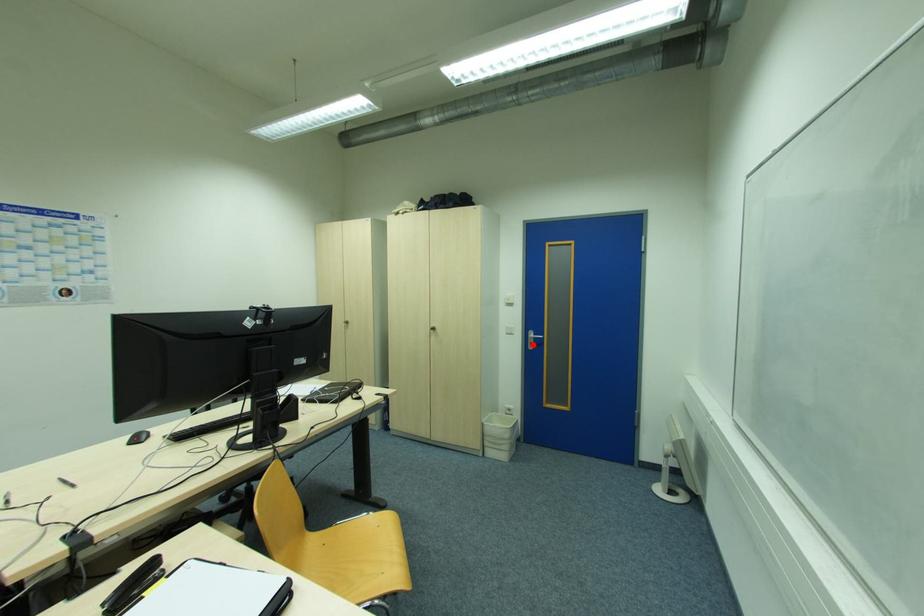
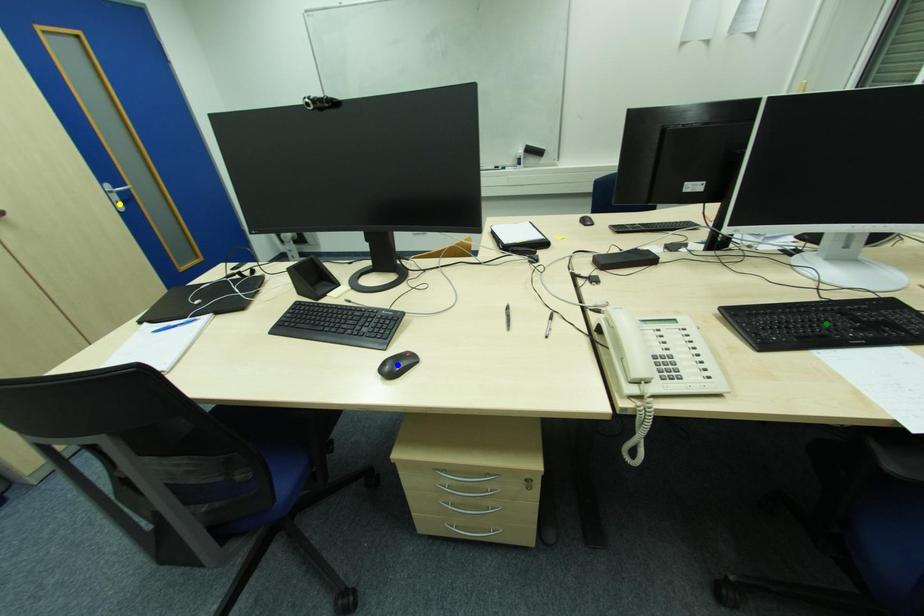
Question: I am providing you with two images of the same scene from different viewpoints. A red point is marked on the first image. You are given multiple points on the second image. Which point in image 2 represents the same 3d spot as the red point in image 1?

Choices:
 (A) yellow point
 (B) blue point
 (C) green point

Answer: (A)